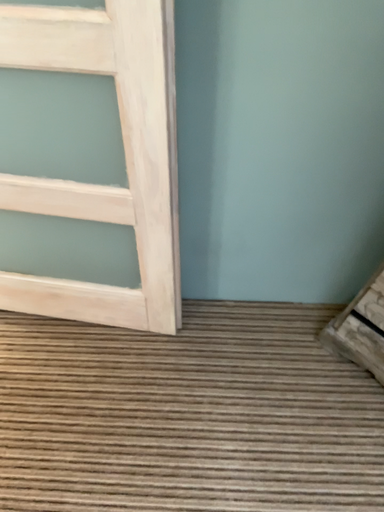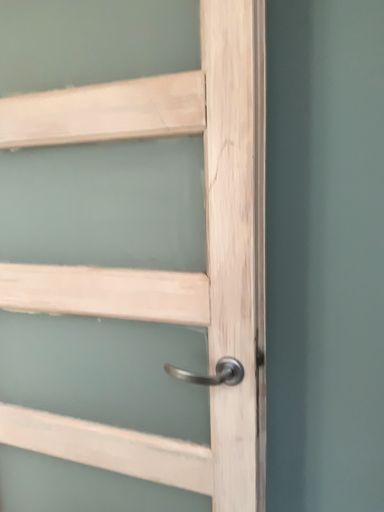
Question: How did the camera likely rotate when shooting the video?

Choices:
 (A) rotated left
 (B) rotated right

Answer: (A)